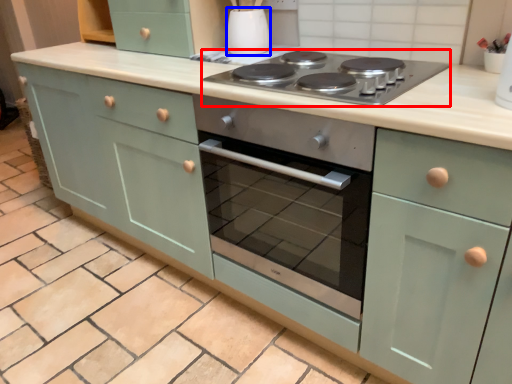
Question: Which object is further to the camera taking this photo, gas stove (highlighted by a red box) or appliance (highlighted by a blue box)?

Choices:
 (A) gas stove
 (B) appliance

Answer: (B)